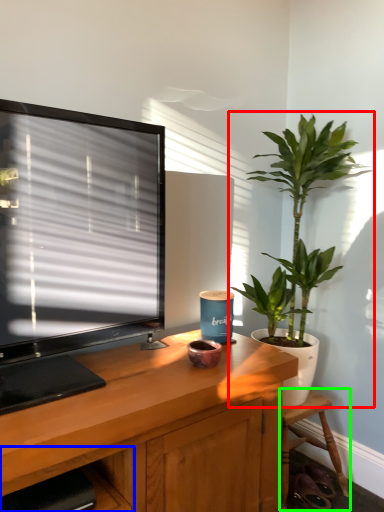
Question: Estimate the real-world distances between objects in this image. Which object is farther from houseplant (highlighted by a red box), shelf (highlighted by a blue box) or chair (highlighted by a green box)?

Choices:
 (A) shelf
 (B) chair

Answer: (A)